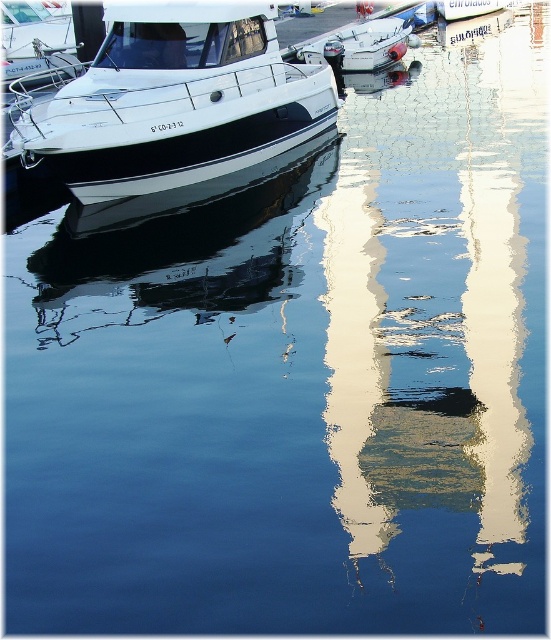
Question: Estimate the real-world distances between objects in this image. Which object is farther from the white glossy boat at center?

Choices:
 (A) white glossy boat at upper left
 (B) white glossy boat at upper center

Answer: (A)

Question: Considering the relative positions of white glossy boat at upper left and white glossy boat at upper center in the image provided, where is white glossy boat at upper left located with respect to white glossy boat at upper center?

Choices:
 (A) left
 (B) right

Answer: (A)

Question: Which object appears farthest from the camera in this image?

Choices:
 (A) white glossy boat at upper left
 (B) white glossy boat at upper center

Answer: (B)

Question: Can you confirm if white glossy boat at upper left is wider than white glossy boat at upper center?

Choices:
 (A) yes
 (B) no

Answer: (B)

Question: Which of the following is the farthest from the observer?

Choices:
 (A) white glossy boat at upper left
 (B) white glossy boat at center
 (C) white glossy boat at upper center

Answer: (B)

Question: Is white glossy boat at upper left positioned behind white glossy boat at center?

Choices:
 (A) yes
 (B) no

Answer: (B)